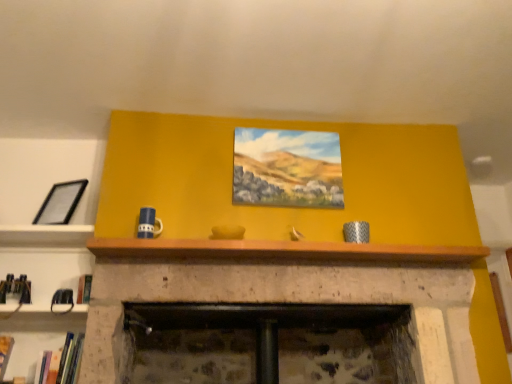
Question: From a real-world perspective, is hardcover book at lower left, which appears as the second book when viewed from the right, under hardcover book at lower left, which is counted as the second book, starting from the left?

Choices:
 (A) no
 (B) yes

Answer: (B)

Question: Is hardcover book at lower left, the 1th book viewed from the left, smaller than hardcover book at lower left, placed as the 1th book when sorted from right to left?

Choices:
 (A) yes
 (B) no

Answer: (A)

Question: Is the surface of hardcover book at lower left, which appears as the second book when viewed from the right, in direct contact with hardcover book at lower left, which is counted as the second book, starting from the left?

Choices:
 (A) no
 (B) yes

Answer: (A)

Question: Is hardcover book at lower left, which is counted as the second book, starting from the left, surrounded by hardcover book at lower left, which appears as the second book when viewed from the right?

Choices:
 (A) yes
 (B) no

Answer: (B)

Question: Is hardcover book at lower left, the 1th book viewed from the left, thinner than hardcover book at lower left, placed as the 1th book when sorted from right to left?

Choices:
 (A) yes
 (B) no

Answer: (A)

Question: Does hardcover book at lower left, which appears as the second book when viewed from the right, have a larger size compared to hardcover book at lower left, which is counted as the second book, starting from the left?

Choices:
 (A) no
 (B) yes

Answer: (A)

Question: From a real-world perspective, is hardcover book at lower left, the 1th book viewed from the left, on top of oil painting at center, which is counted as the first picture frame, starting from the right?

Choices:
 (A) no
 (B) yes

Answer: (A)

Question: Can you confirm if hardcover book at lower left, the 1th book viewed from the left, is positioned to the right of oil painting at center, placed as the 2th picture frame when sorted from left to right?

Choices:
 (A) yes
 (B) no

Answer: (B)

Question: Is hardcover book at lower left, which appears as the second book when viewed from the right, beside oil painting at center, which is counted as the first picture frame, starting from the right?

Choices:
 (A) yes
 (B) no

Answer: (B)

Question: Does hardcover book at lower left, which appears as the second book when viewed from the right, have a greater width compared to oil painting at center, which is counted as the first picture frame, starting from the right?

Choices:
 (A) yes
 (B) no

Answer: (A)

Question: Is hardcover book at lower left, the 1th book viewed from the left, turned away from oil painting at center, which is counted as the first picture frame, starting from the right?

Choices:
 (A) no
 (B) yes

Answer: (A)

Question: Is hardcover book at lower left, which appears as the second book when viewed from the right, taller than oil painting at center, placed as the 2th picture frame when sorted from left to right?

Choices:
 (A) yes
 (B) no

Answer: (B)

Question: Could you tell me if wooden at upper center is turned towards hardcover book at lower left, which appears as the second book when viewed from the right?

Choices:
 (A) yes
 (B) no

Answer: (B)